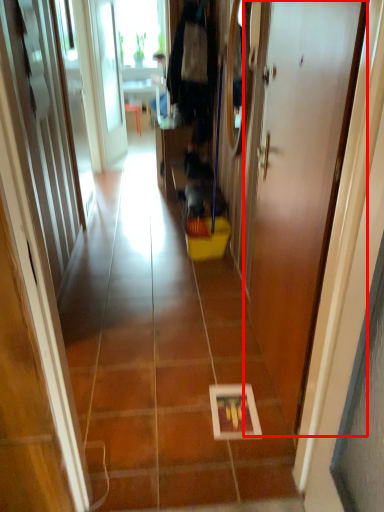
Question: From the image's perspective, what is the correct spatial relationship of door (annotated by the red box) in relation to path?

Choices:
 (A) above
 (B) below

Answer: (B)